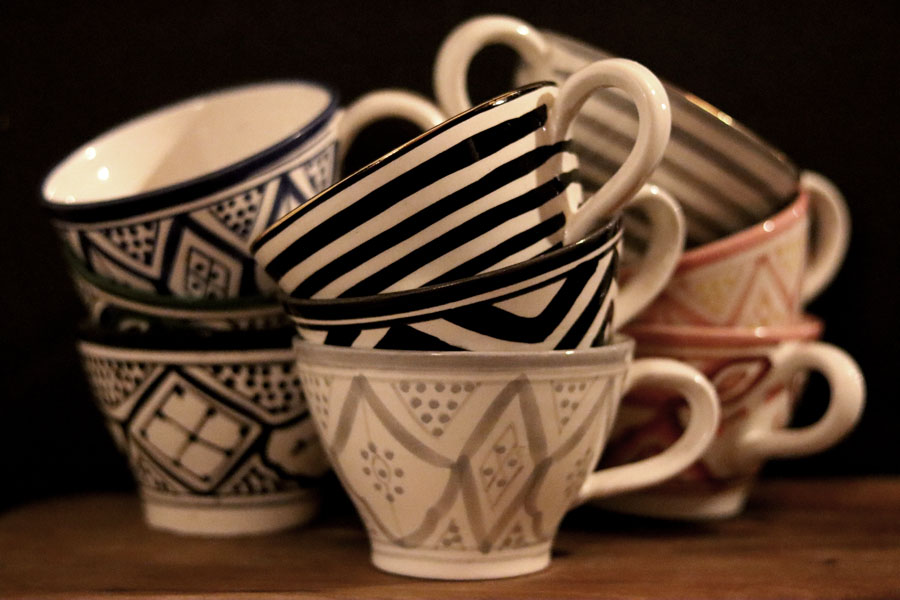
The height and width of the screenshot is (600, 900). Find the location of `tea cups`. tea cups is located at coordinates (168, 414), (149, 319), (176, 234), (414, 222), (472, 330), (481, 453), (750, 378), (752, 283), (699, 187).